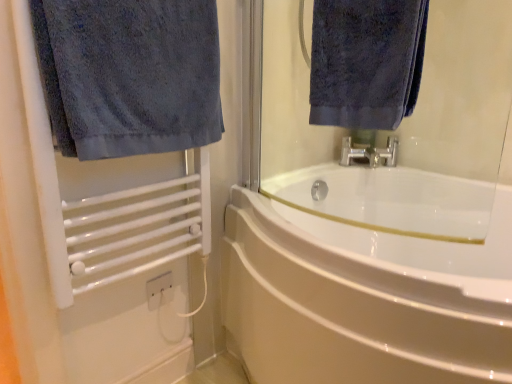
Question: From the image's perspective, is dark blue terry cloth towel at left, arranged as the first towel when viewed from the left, beneath white matte towel rack at left?

Choices:
 (A) yes
 (B) no

Answer: (B)

Question: Does dark blue terry cloth towel at left, arranged as the first towel when viewed from the left, have a greater height compared to white matte towel rack at left?

Choices:
 (A) yes
 (B) no

Answer: (B)

Question: Considering the relative sizes of dark blue terry cloth towel at left, arranged as the first towel when viewed from the left, and white matte towel rack at left in the image provided, is dark blue terry cloth towel at left, arranged as the first towel when viewed from the left, bigger than white matte towel rack at left?

Choices:
 (A) no
 (B) yes

Answer: (A)

Question: Can you confirm if dark blue terry cloth towel at left, which is counted as the second towel, starting from the right, is smaller than white matte towel rack at left?

Choices:
 (A) yes
 (B) no

Answer: (A)

Question: Is dark blue terry cloth towel at left, arranged as the first towel when viewed from the left, not close to white matte towel rack at left?

Choices:
 (A) yes
 (B) no

Answer: (B)

Question: From a real-world perspective, is white glossy bathtub at center physically located above or below dark blue terry cloth towel at left, which is counted as the second towel, starting from the right?

Choices:
 (A) below
 (B) above

Answer: (A)

Question: Is white glossy bathtub at center wider or thinner than dark blue terry cloth towel at left, arranged as the first towel when viewed from the left?

Choices:
 (A) thin
 (B) wide

Answer: (B)

Question: Is white glossy bathtub at center situated inside dark blue terry cloth towel at left, which is counted as the second towel, starting from the right, or outside?

Choices:
 (A) inside
 (B) outside

Answer: (B)

Question: Is white glossy bathtub at center in front of or behind dark blue terry cloth towel at left, which is counted as the second towel, starting from the right, in the image?

Choices:
 (A) behind
 (B) front

Answer: (B)

Question: Would you say white glossy bathtub at center is inside or outside white matte towel rack at left?

Choices:
 (A) outside
 (B) inside

Answer: (A)

Question: Is white glossy bathtub at center to the left or to the right of white matte towel rack at left in the image?

Choices:
 (A) right
 (B) left

Answer: (A)

Question: From the image's perspective, is white glossy bathtub at center located above or below white matte towel rack at left?

Choices:
 (A) below
 (B) above

Answer: (A)

Question: Is point (376, 347) closer or farther from the camera than point (148, 248)?

Choices:
 (A) closer
 (B) farther

Answer: (A)

Question: Would you say white matte towel rack at left is to the left or to the right of white glossy bathtub at center in the picture?

Choices:
 (A) left
 (B) right

Answer: (A)

Question: Considering the positions of white matte towel rack at left and white glossy bathtub at center in the image, is white matte towel rack at left bigger or smaller than white glossy bathtub at center?

Choices:
 (A) small
 (B) big

Answer: (A)